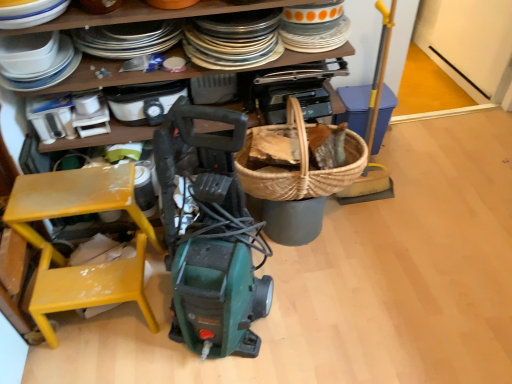
Question: Can you confirm if woven basket at right, which ranks as the fifth appliance in left-to-right order, is smaller than white plastic toaster at upper center, the fourth appliance positioned from the left?

Choices:
 (A) no
 (B) yes

Answer: (A)

Question: Could you tell me if woven basket at right, which ranks as the fifth appliance in left-to-right order, is facing white plastic toaster at upper center, the fourth appliance positioned from the left?

Choices:
 (A) yes
 (B) no

Answer: (B)

Question: Can you see woven basket at right, which ranks as the fifth appliance in left-to-right order, touching white plastic toaster at upper center, acting as the 2th appliance starting from the right?

Choices:
 (A) yes
 (B) no

Answer: (B)

Question: Is woven basket at right, which is the first appliance in right-to-left order, looking in the opposite direction of white plastic toaster at upper center, acting as the 2th appliance starting from the right?

Choices:
 (A) yes
 (B) no

Answer: (B)

Question: Is woven basket at right, which is the first appliance in right-to-left order, outside of white plastic toaster at upper center, the fourth appliance positioned from the left?

Choices:
 (A) no
 (B) yes

Answer: (B)

Question: Looking at their shapes, would you say green plastic vacuum cleaner at center is wider or thinner than woven wood basket at center?

Choices:
 (A) wide
 (B) thin

Answer: (A)

Question: In the image, is green plastic vacuum cleaner at center positioned in front of or behind woven wood basket at center?

Choices:
 (A) front
 (B) behind

Answer: (A)

Question: Looking at the image, does green plastic vacuum cleaner at center seem bigger or smaller compared to woven wood basket at center?

Choices:
 (A) big
 (B) small

Answer: (A)

Question: Is point (89, 279) closer or farther from the camera than point (268, 195)?

Choices:
 (A) closer
 (B) farther

Answer: (A)

Question: In terms of size, does white glossy plates at upper left appear bigger or smaller than woven basket at right, which is the first appliance in right-to-left order?

Choices:
 (A) big
 (B) small

Answer: (A)

Question: From the image's perspective, is white glossy plates at upper left above or below woven basket at right, which is the first appliance in right-to-left order?

Choices:
 (A) below
 (B) above

Answer: (B)

Question: Looking at their shapes, would you say white glossy plates at upper left is wider or thinner than woven basket at right, which ranks as the fifth appliance in left-to-right order?

Choices:
 (A) wide
 (B) thin

Answer: (A)

Question: Considering the positions of white glossy plates at upper left and woven basket at right, which ranks as the fifth appliance in left-to-right order, in the image, is white glossy plates at upper left taller or shorter than woven basket at right, which ranks as the fifth appliance in left-to-right order,?

Choices:
 (A) tall
 (B) short

Answer: (B)

Question: Is woven wood basket at center situated inside white plastic toaster at upper center, acting as the 2th appliance starting from the right, or outside?

Choices:
 (A) outside
 (B) inside

Answer: (A)

Question: Is woven wood basket at center wider or thinner than white plastic toaster at upper center, the fourth appliance positioned from the left?

Choices:
 (A) thin
 (B) wide

Answer: (B)